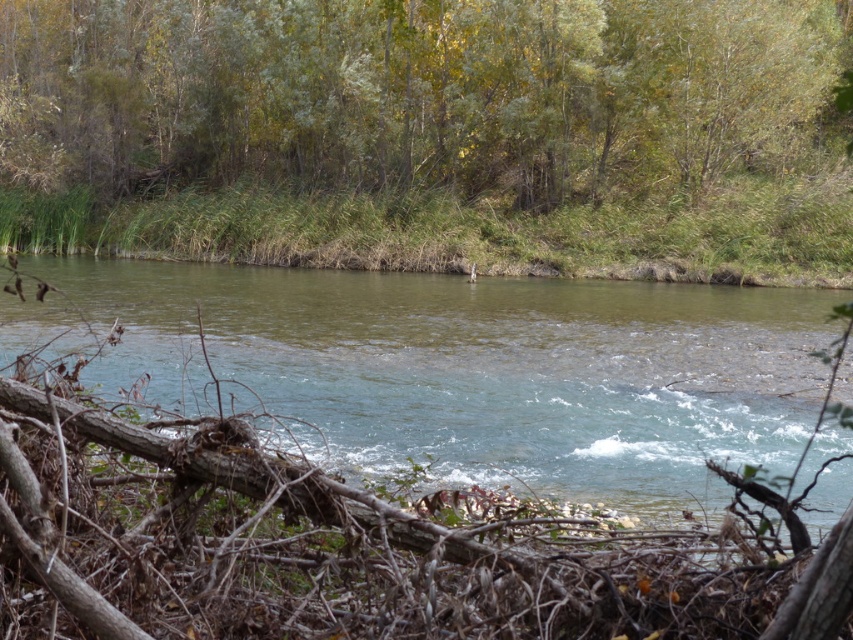
You are a bird flying over the river and want to land on the green leafy trees at upper center. Based on the coordinates provided, can you determine the exact location where you should aim to land?

The green leafy trees at upper center are located at coordinates point [419,92], so you should aim for that exact point to land.

You are standing at the edge of the river and want to look at the clear water at center. Which direction should you turn to first see the green leafy trees at upper center?

The green leafy trees at upper center are to the left of the clear water at center, so you should turn to your left to first see the green leafy trees at upper center.

You are a hiker who wants to cross the river using a fallen tree branch. The branch is in the foreground. The green leafy trees at upper center and the clear water at center are in your view. Which object is wider when viewed from above?

The green leafy trees at upper center are wider than the clear water at center.